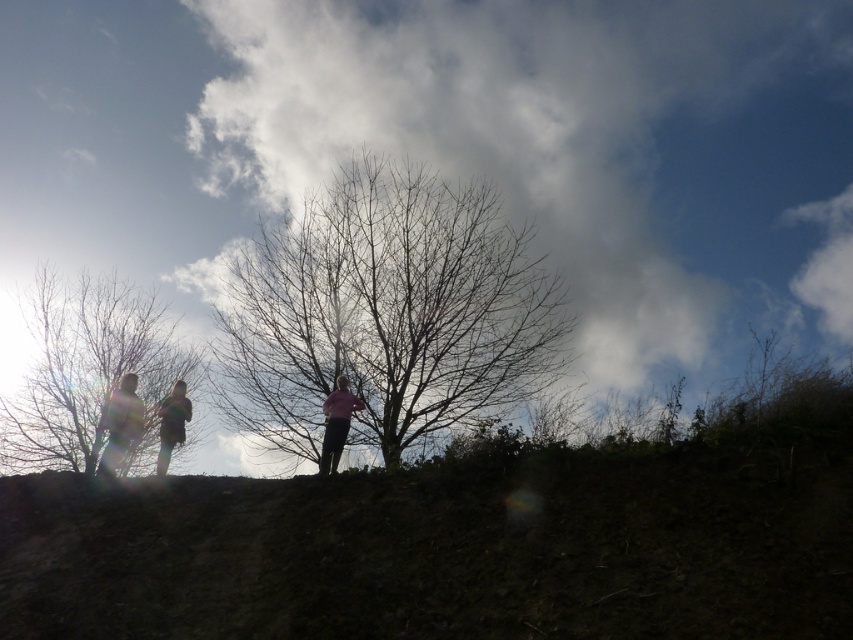
Question: In this image, where is bare branches at center located relative to pink fabric at center?

Choices:
 (A) left
 (B) right

Answer: (B)

Question: Is dull brown dirt at center positioned behind silhouette clothing at left?

Choices:
 (A) yes
 (B) no

Answer: (B)

Question: Can you confirm if bare branches at left is positioned to the right of silhouette clothing at center?

Choices:
 (A) yes
 (B) no

Answer: (B)

Question: Which object is closer to the camera taking this photo?

Choices:
 (A) silhouette clothing at center
 (B) white fluffy cloud at upper center
 (C) bare branches at center
 (D) dull brown dirt at center

Answer: (D)

Question: Based on their relative distances, which object is farther from the pink fabric at center?

Choices:
 (A) silhouette clothing at left
 (B) bare branches at center
 (C) bare branches at left
 (D) silhouette clothing at center

Answer: (C)

Question: Among these points, which one is farthest from the camera?

Choices:
 (A) (393, 336)
 (B) (799, 28)

Answer: (B)